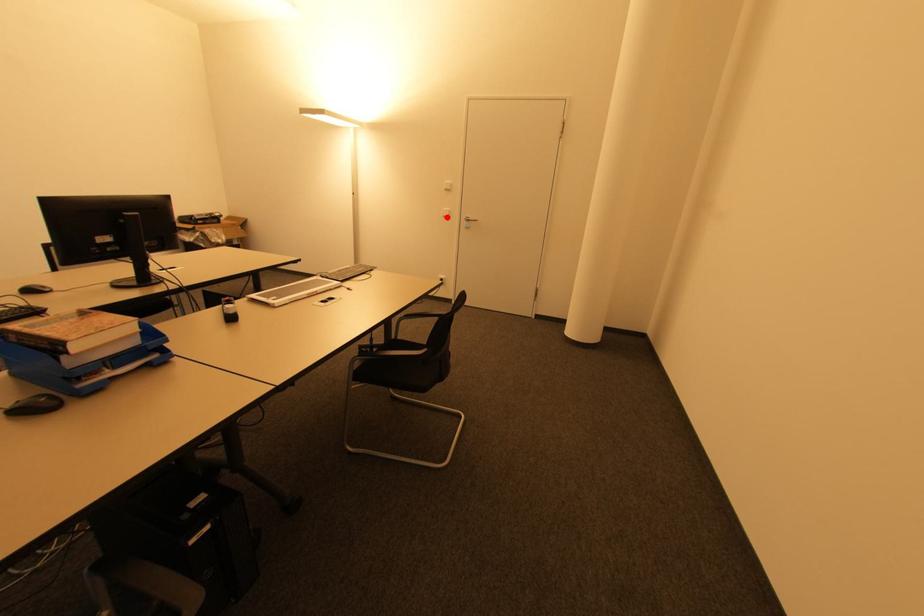
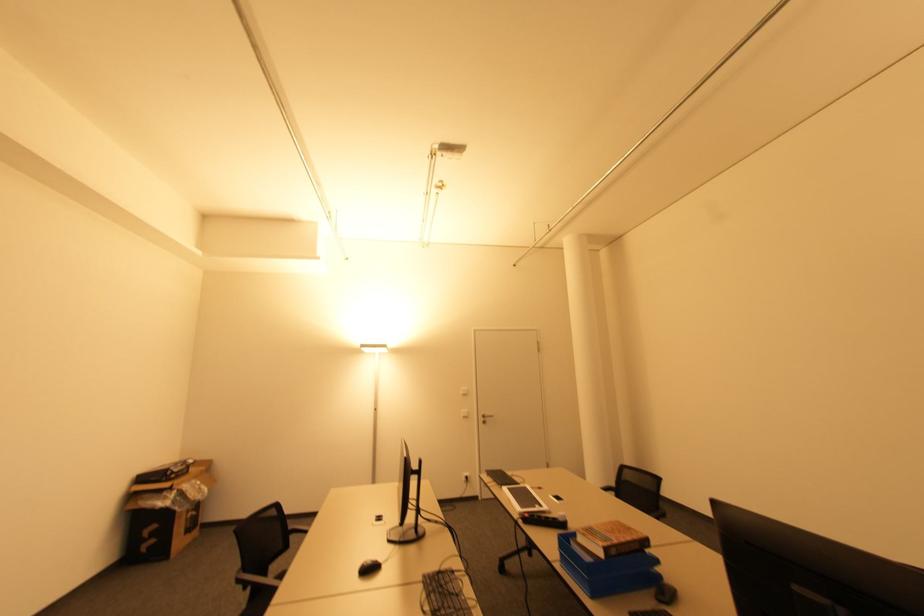
Question: A red point is marked in image1. In image2, is the corresponding 3D point closer to the camera or farther? Reply with the corresponding letter.

Choices:
 (A) The corresponding 3D point is closer.
 (B) The corresponding 3D point is farther.

Answer: (B)